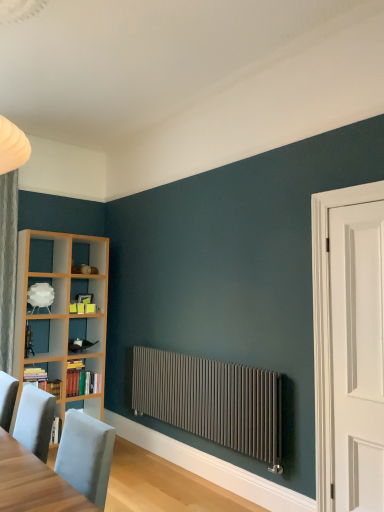
The width and height of the screenshot is (384, 512). What are the coordinates of `blank space situated above white matte door at right (from a real-world perspective)` in the screenshot? It's located at (357, 203).